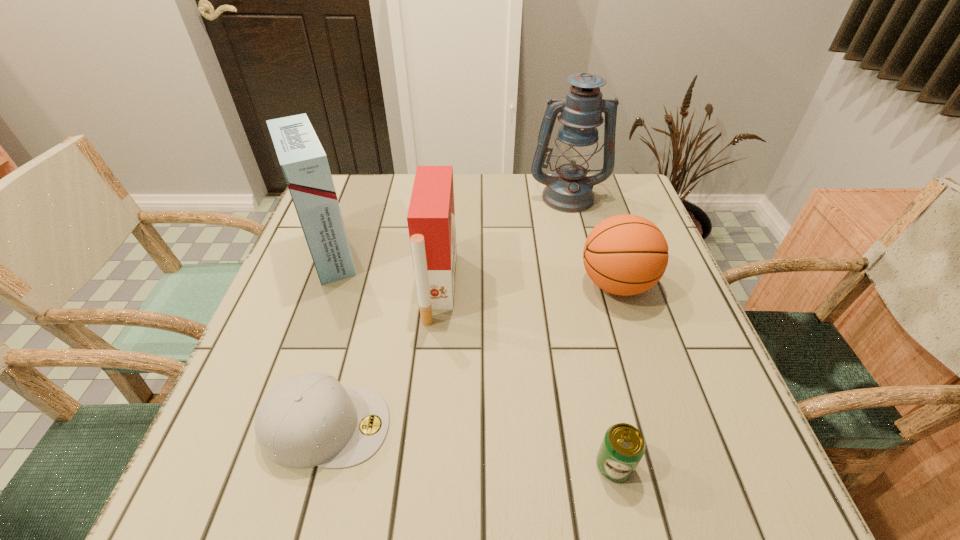
What are the coordinates of `lantern` in the screenshot? It's located at (569, 190).

I want to click on the taller cigarette case, so click(304, 163).

You are a GUI agent. You are given a task and a screenshot of the screen. Output one action in this format:
    pyautogui.click(x=<x>, y=<y>)
    Task: Click on the right cigarette case
    The height and width of the screenshot is (540, 960).
    Given the screenshot: What is the action you would take?
    pyautogui.click(x=431, y=215)

Find the location of a particular element. This screenshot has height=540, width=960. the third object from left to right is located at coordinates (431, 215).

I want to click on basketball, so click(x=626, y=254).

This screenshot has width=960, height=540. In order to click on cap in this screenshot , I will do `click(307, 420)`.

The height and width of the screenshot is (540, 960). What are the coordinates of `beer can` in the screenshot? It's located at [x=623, y=446].

Where is `vacant space situated 0.340m on the front-facing side of the farthest object`? This screenshot has width=960, height=540. vacant space situated 0.340m on the front-facing side of the farthest object is located at coordinates (594, 304).

This screenshot has height=540, width=960. In order to click on blank space located on the right of the taller cigarette case in this screenshot , I will do `click(423, 254)`.

Where is `blank area located on the front-facing side of the right cigarette case`? The image size is (960, 540). blank area located on the front-facing side of the right cigarette case is located at coordinates (603, 287).